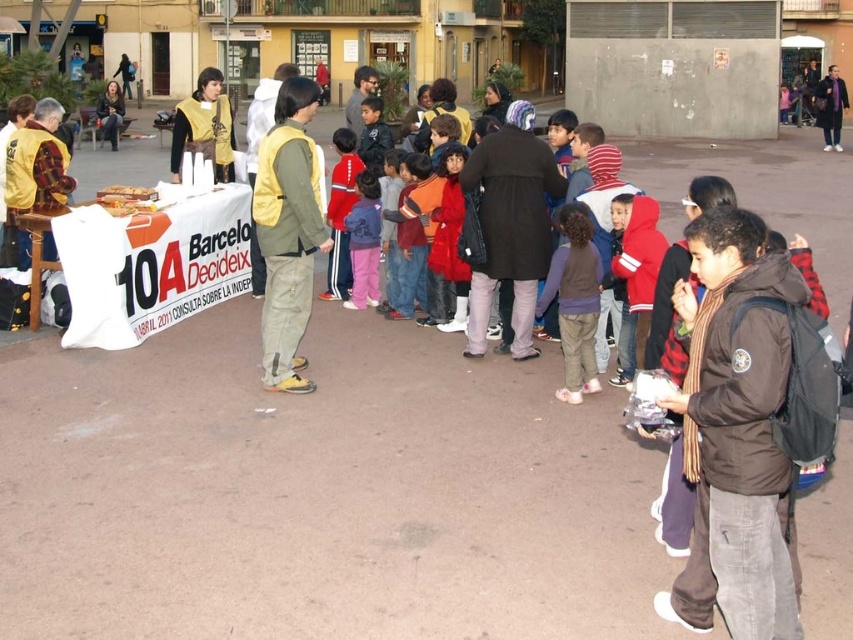
Question: Can you confirm if yellow fabric vest at center is wider than purple scarf at center?

Choices:
 (A) yes
 (B) no

Answer: (A)

Question: Based on their relative distances, which object is farther from the purple scarf at center?

Choices:
 (A) matte yellow vest at left
 (B) matte yellow vest at center

Answer: (B)

Question: Can you confirm if matte gold vest at center is thinner than matte yellow vest at center?

Choices:
 (A) no
 (B) yes

Answer: (A)

Question: Which point is farther to the camera?

Choices:
 (A) yellow fabric vest at center
 (B) matte yellow vest at center
 (C) purple scarf at center

Answer: (B)

Question: Does brown matte jacket at lower right have a greater width compared to matte yellow vest at left?

Choices:
 (A) no
 (B) yes

Answer: (A)

Question: Which point is closer to the camera?

Choices:
 (A) (215, 124)
 (B) (820, 104)
 (C) (120, 97)
 (D) (718, 356)

Answer: (D)